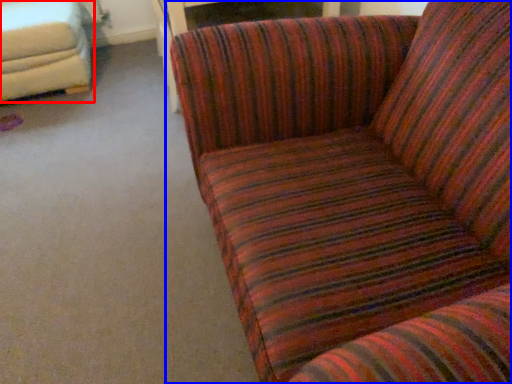
Question: Among these objects, which one is nearest to the camera, studio couch (highlighted by a red box) or studio couch (highlighted by a blue box)?

Choices:
 (A) studio couch
 (B) studio couch

Answer: (B)